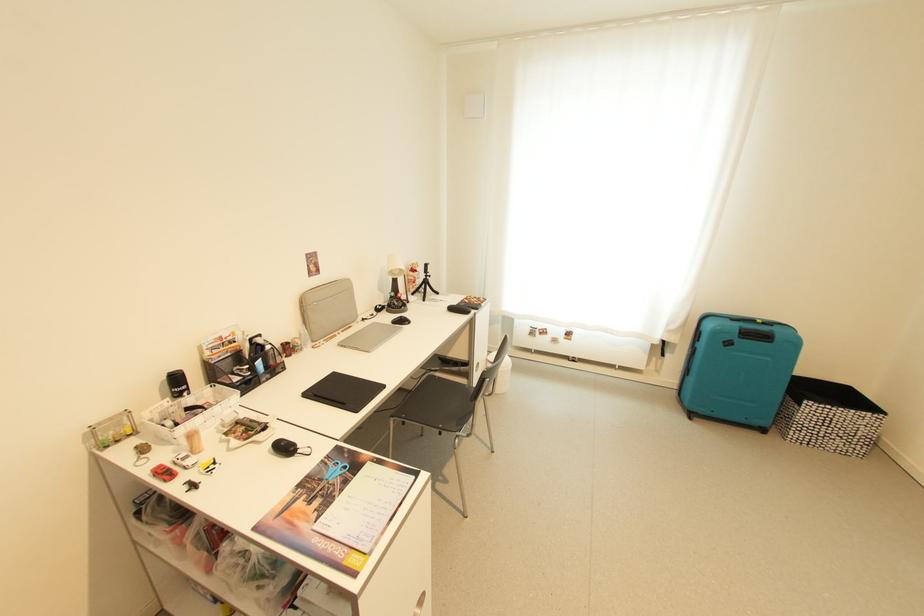
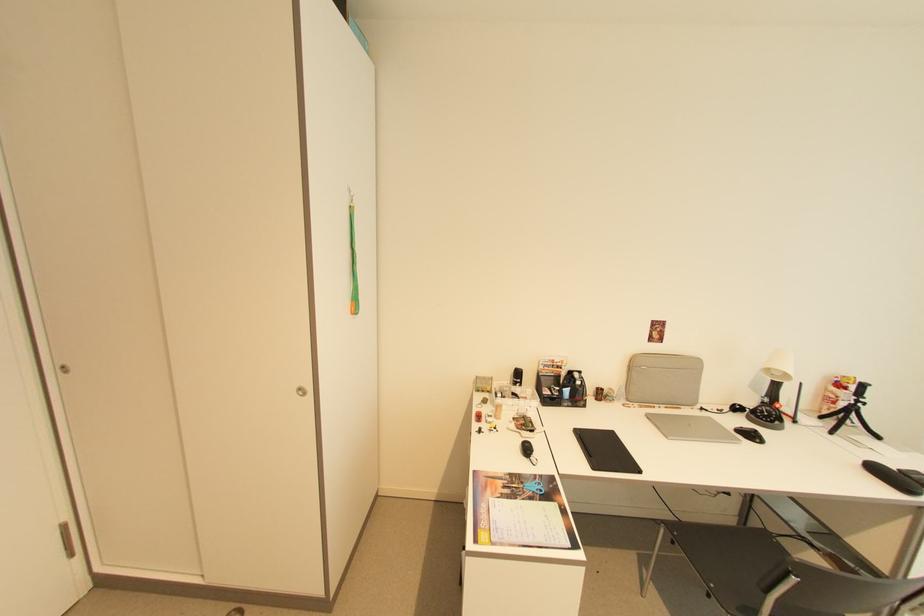
Where in the second image is the point corresponding to point (411, 323) from the first image?

(762, 442)